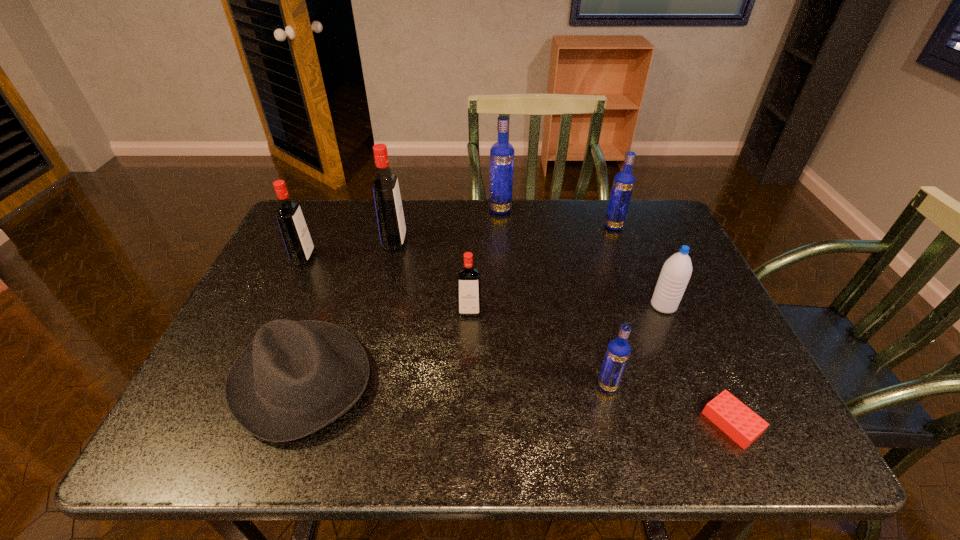
Identify the location of water bottle located at the right edge. This screenshot has height=540, width=960. (676, 272).

You are a GUI agent. You are given a task and a screenshot of the screen. Output one action in this format:
    pyautogui.click(x=<x>, y=<y>)
    Task: Click on the Lego that is at the right edge
    This screenshot has width=960, height=540.
    Given the screenshot: What is the action you would take?
    pyautogui.click(x=740, y=423)

The image size is (960, 540). What are the coordinates of `object that is positioned at the near left corner` in the screenshot? It's located at [296, 377].

Find the location of a particular element. The height and width of the screenshot is (540, 960). object that is at the far right corner is located at coordinates (623, 183).

Image resolution: width=960 pixels, height=540 pixels. What are the coordinates of `object positioned at the near right corner` in the screenshot? It's located at (740, 423).

Where is `free point at the far edge`? The width and height of the screenshot is (960, 540). free point at the far edge is located at coordinates (532, 238).

Find the location of `free spot at the near edge of the desktop`. free spot at the near edge of the desktop is located at coordinates [x=489, y=442].

This screenshot has width=960, height=540. In the image, there is a desktop. In order to click on blank space at the left edge in this screenshot , I will do `click(326, 255)`.

The image size is (960, 540). I want to click on vacant space at the right edge of the desktop, so click(x=758, y=402).

What are the coordinates of `vacant space at the far left corner` in the screenshot? It's located at (343, 201).